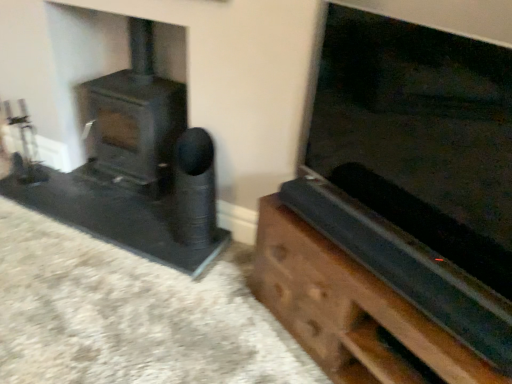
Question: In the image, is black matte speaker at center positioned in front of or behind matte black wood burning stove at left?

Choices:
 (A) behind
 (B) front

Answer: (B)

Question: Considering the positions of point (180, 158) and point (130, 84), is point (180, 158) closer or farther from the camera than point (130, 84)?

Choices:
 (A) farther
 (B) closer

Answer: (B)

Question: Considering the real-world distances, which object is farthest from the matte black wood burning stove at left?

Choices:
 (A) black matte speaker at center
 (B) wooden chest at right

Answer: (B)

Question: Which object is positioned closest to the wooden chest at right?

Choices:
 (A) black matte speaker at center
 (B) matte black wood burning stove at left

Answer: (A)